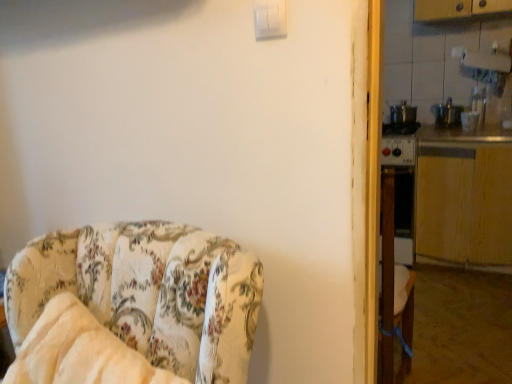
Question: Are floral fabric chair at left and metallic silver counter top at right, which ranks as the second counter top in bottom-to-top order, beside each other?

Choices:
 (A) no
 (B) yes

Answer: (A)

Question: Would you say floral fabric chair at left contains metallic silver counter top at right, which ranks as the second counter top in bottom-to-top order?

Choices:
 (A) yes
 (B) no

Answer: (B)

Question: From the image's perspective, is floral fabric chair at left below metallic silver counter top at right, which ranks as the second counter top in bottom-to-top order?

Choices:
 (A) no
 (B) yes

Answer: (B)

Question: Considering the relative positions of floral fabric chair at left and metallic silver counter top at right, which appears as the first counter top when viewed from the top, in the image provided, is floral fabric chair at left in front of metallic silver counter top at right, which appears as the first counter top when viewed from the top,?

Choices:
 (A) no
 (B) yes

Answer: (B)

Question: Is floral fabric chair at left far away from metallic silver counter top at right, which appears as the first counter top when viewed from the top?

Choices:
 (A) no
 (B) yes

Answer: (B)

Question: In the image, is wooden at right, which appears as the first counter top when ordered from the bottom, on the left side or the right side of floral fabric chair at left?

Choices:
 (A) right
 (B) left

Answer: (A)

Question: Considering the positions of point (438, 198) and point (20, 259), is point (438, 198) closer or farther from the camera than point (20, 259)?

Choices:
 (A) closer
 (B) farther

Answer: (B)

Question: Considering their positions, is wooden at right, which appears as the first counter top when ordered from the bottom, located in front of or behind floral fabric chair at left?

Choices:
 (A) front
 (B) behind

Answer: (B)

Question: From the image's perspective, is wooden at right, placed as the 2th counter top when sorted from top to bottom, positioned above or below floral fabric chair at left?

Choices:
 (A) below
 (B) above

Answer: (B)

Question: Considering their positions, is white plastic light switch at upper center located in front of or behind wooden at right, placed as the 2th counter top when sorted from top to bottom?

Choices:
 (A) behind
 (B) front

Answer: (B)

Question: In the image, is white plastic light switch at upper center on the left side or the right side of wooden at right, placed as the 2th counter top when sorted from top to bottom?

Choices:
 (A) right
 (B) left

Answer: (B)

Question: Considering the positions of white plastic light switch at upper center and wooden at right, which appears as the first counter top when ordered from the bottom, in the image, is white plastic light switch at upper center taller or shorter than wooden at right, which appears as the first counter top when ordered from the bottom,?

Choices:
 (A) short
 (B) tall

Answer: (A)

Question: Is white plastic light switch at upper center wider or thinner than wooden at right, which appears as the first counter top when ordered from the bottom?

Choices:
 (A) thin
 (B) wide

Answer: (A)

Question: From their relative heights in the image, would you say metallic silver counter top at right, which appears as the first counter top when viewed from the top, is taller or shorter than white plastic light switch at upper center?

Choices:
 (A) tall
 (B) short

Answer: (B)

Question: Do you think metallic silver counter top at right, which appears as the first counter top when viewed from the top, is within white plastic light switch at upper center, or outside of it?

Choices:
 (A) inside
 (B) outside

Answer: (B)